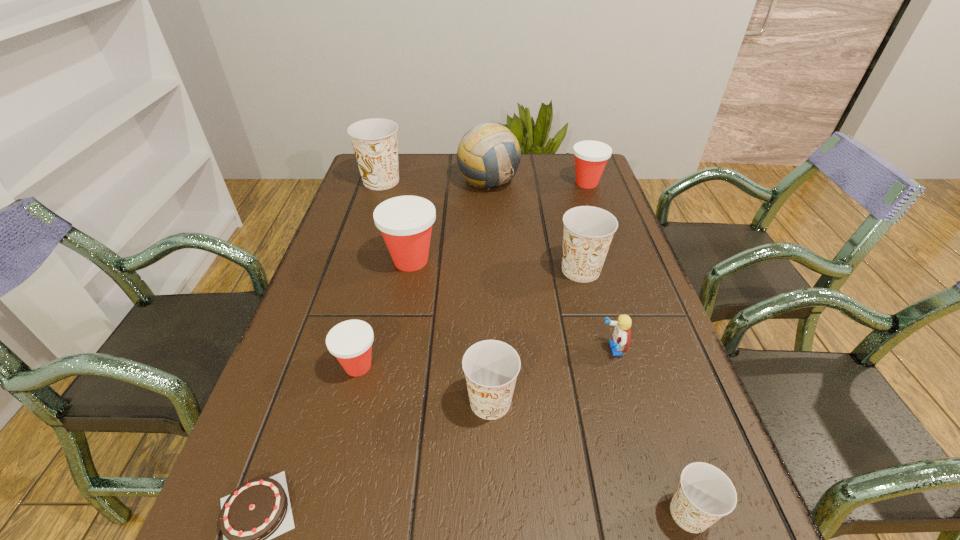
What are the coordinates of `vacant space situated on the front-facing side of the Lego` in the screenshot? It's located at 429,349.

The image size is (960, 540). What are the coordinates of `vacant space located on the front-facing side of the Lego` in the screenshot? It's located at (573, 349).

You are a GUI agent. You are given a task and a screenshot of the screen. Output one action in this format:
    pyautogui.click(x=<x>, y=<y>)
    Task: Click on the free region located on the front of the smallest red-orange Dixie cup
    This screenshot has width=960, height=540.
    Given the screenshot: What is the action you would take?
    pyautogui.click(x=327, y=489)

Where is `vacant space located on the left of the nearest orange Dixie cup`? The image size is (960, 540). vacant space located on the left of the nearest orange Dixie cup is located at coordinates (465, 513).

Where is `volleyball that is at the far edge`? volleyball that is at the far edge is located at coordinates (488, 156).

Locate an element on the screen. Image resolution: width=960 pixels, height=540 pixels. Lego present at the right edge is located at coordinates (622, 333).

This screenshot has height=540, width=960. I want to click on object situated at the far left corner, so click(x=374, y=141).

At what (x,y) coordinates should I click in order to perform the action: click on object present at the far right corner. Please return your answer as a coordinate pair (x, y). Image resolution: width=960 pixels, height=540 pixels. Looking at the image, I should click on (591, 157).

What are the coordinates of `vacant area at the far edge` in the screenshot? It's located at (533, 185).

The width and height of the screenshot is (960, 540). In the image, there is a desktop. Identify the location of free space at the left edge. [x=344, y=424].